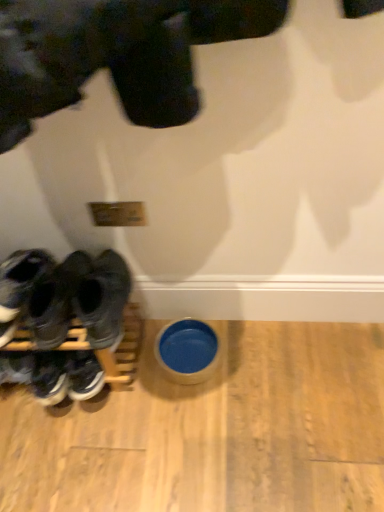
What do you see at coordinates (187, 351) in the screenshot? I see `blue ceramic bowl at lower center` at bounding box center [187, 351].

Locate an element on the screen. black rubber shoes at left, the 3th footwear viewed from the left is located at coordinates (103, 298).

In the image, is blue ceramic bowl at lower center on the left side or the right side of black leather sneakers at left, which is counted as the 1th footwear, starting from the left?

From the image, it's evident that blue ceramic bowl at lower center is to the right of black leather sneakers at left, which is counted as the 1th footwear, starting from the left.

Considering the sizes of blue ceramic bowl at lower center and black leather sneakers at left, which is the third footwear from right to left, in the image, is blue ceramic bowl at lower center taller or shorter than black leather sneakers at left, which is the third footwear from right to left,?

In the image, blue ceramic bowl at lower center appears to be shorter than black leather sneakers at left, which is the third footwear from right to left.

From the picture: Which object is more forward, blue ceramic bowl at lower center or black leather sneakers at left, which is the third footwear from right to left?

black leather sneakers at left, which is the third footwear from right to left, is more forward.

From the image's perspective, is black rubber shoes at left, the 3th footwear viewed from the left, above blue ceramic bowl at lower center?

Yes, from the image's perspective, black rubber shoes at left, the 3th footwear viewed from the left, is above blue ceramic bowl at lower center.

Considering the relative sizes of black rubber shoes at left, the 3th footwear viewed from the left, and blue ceramic bowl at lower center in the image provided, is black rubber shoes at left, the 3th footwear viewed from the left, taller than blue ceramic bowl at lower center?

Yes.

How different are the orientations of black rubber shoes at left, which is the 1th footwear in right-to-left order, and blue ceramic bowl at lower center in degrees?

6.23 degrees.

In the image, is black rubber shoes at left, the 3th footwear viewed from the left, positioned in front of or behind blue ceramic bowl at lower center?

Visually, black rubber shoes at left, the 3th footwear viewed from the left, is located in front of blue ceramic bowl at lower center.

Based on the photo, which is closer, (18, 289) or (51, 376)?

Point (18, 289) appears to be closer to the viewer than point (51, 376).

Considering the relative sizes of dark gray suede sneakers at left, the second footwear viewed from the right, and black leather sneakers at left, which is the third footwear from right to left, in the image provided, is dark gray suede sneakers at left, the second footwear viewed from the right, thinner than black leather sneakers at left, which is the third footwear from right to left,?

No, dark gray suede sneakers at left, the second footwear viewed from the right, is not thinner than black leather sneakers at left, which is the third footwear from right to left.

Is the depth of dark gray suede sneakers at left, the second footwear viewed from the right, greater than that of black leather sneakers at left, which is counted as the 1th footwear, starting from the left?

No, dark gray suede sneakers at left, the second footwear viewed from the right, is in front of black leather sneakers at left, which is counted as the 1th footwear, starting from the left.

Is blue ceramic bowl at lower center with dark gray suede sneakers at left, the second footwear viewed from the right?

blue ceramic bowl at lower center is not next to dark gray suede sneakers at left, the second footwear viewed from the right, and they're not touching.

Is blue ceramic bowl at lower center oriented away from dark gray suede sneakers at left, the second footwear viewed from the right?

blue ceramic bowl at lower center is not turned away from dark gray suede sneakers at left, the second footwear viewed from the right.

Between blue ceramic bowl at lower center and dark gray suede sneakers at left, the second footwear viewed from the right, which one appears on the right side from the viewer's perspective?

From the viewer's perspective, blue ceramic bowl at lower center appears more on the right side.

Based on the photo, how different are the orientations of dark gray suede sneakers at left, the second footwear viewed from the right, and black rubber shoes at left, which is the 1th footwear in right-to-left order, in degrees?

The angle between the facing direction of dark gray suede sneakers at left, the second footwear viewed from the right, and the facing direction of black rubber shoes at left, which is the 1th footwear in right-to-left order, is 4.07 degrees.

Is dark gray suede sneakers at left, the second footwear from the left, facing away from black rubber shoes at left, which is the 1th footwear in right-to-left order?

That's not correct — dark gray suede sneakers at left, the second footwear from the left, is not looking away from black rubber shoes at left, which is the 1th footwear in right-to-left order.

Looking at this image, which is behind, dark gray suede sneakers at left, the second footwear from the left, or black rubber shoes at left, the 3th footwear viewed from the left?

Positioned behind is dark gray suede sneakers at left, the second footwear from the left.

Considering the relative sizes of dark gray suede sneakers at left, the second footwear viewed from the right, and black rubber shoes at left, which is the 1th footwear in right-to-left order, in the image provided, is dark gray suede sneakers at left, the second footwear viewed from the right, smaller than black rubber shoes at left, which is the 1th footwear in right-to-left order,?

Yes.

Does black leather sneakers at left, which is the third footwear from right to left, have a larger size compared to blue ceramic bowl at lower center?

Yes.

Are black leather sneakers at left, which is the third footwear from right to left, and blue ceramic bowl at lower center located far from each other?

No, there isn't a large distance between black leather sneakers at left, which is the third footwear from right to left, and blue ceramic bowl at lower center.

From a real-world perspective, is black leather sneakers at left, which is counted as the 1th footwear, starting from the left, over blue ceramic bowl at lower center?

Yes, from a real-world perspective, black leather sneakers at left, which is counted as the 1th footwear, starting from the left, is above blue ceramic bowl at lower center.

Considering the relative positions of dark gray suede sneakers at left, the second footwear viewed from the right, and blue ceramic bowl at lower center in the image provided, is dark gray suede sneakers at left, the second footwear viewed from the right, to the right of blue ceramic bowl at lower center from the viewer's perspective?

No, dark gray suede sneakers at left, the second footwear viewed from the right, is not to the right of blue ceramic bowl at lower center.

Can you tell me how much dark gray suede sneakers at left, the second footwear from the left, and blue ceramic bowl at lower center differ in facing direction?

2.16 degrees.

Considering the relative positions of dark gray suede sneakers at left, the second footwear from the left, and blue ceramic bowl at lower center in the image provided, is dark gray suede sneakers at left, the second footwear from the left, behind blue ceramic bowl at lower center?

No, dark gray suede sneakers at left, the second footwear from the left, is closer to the camera.

Who is bigger, dark gray suede sneakers at left, the second footwear viewed from the right, or blue ceramic bowl at lower center?

dark gray suede sneakers at left, the second footwear viewed from the right.

From the image's perspective, starting from the blue ceramic bowl at lower center, which footwear is the 1st one above? Please provide its 2D coordinates.

[(61, 321)]

Where is `the 1st footwear to the left of the blue ceramic bowl at lower center, starting your count from the anchor`? The image size is (384, 512). the 1st footwear to the left of the blue ceramic bowl at lower center, starting your count from the anchor is located at coordinates (103, 298).

Based on their spatial positions, is dark gray suede sneakers at left, the second footwear viewed from the right, or black rubber shoes at left, the 3th footwear viewed from the left, closer to blue ceramic bowl at lower center?

black rubber shoes at left, the 3th footwear viewed from the left, lies closer to blue ceramic bowl at lower center than the other object.

Estimate the real-world distances between objects in this image. Which object is further from black rubber shoes at left, the 3th footwear viewed from the left, black leather sneakers at left, which is counted as the 1th footwear, starting from the left, or blue ceramic bowl at lower center?

blue ceramic bowl at lower center lies further to black rubber shoes at left, the 3th footwear viewed from the left, than the other object.

When comparing their distances from dark gray suede sneakers at left, the second footwear from the left, does blue ceramic bowl at lower center or black rubber shoes at left, which is the 1th footwear in right-to-left order, seem further?

blue ceramic bowl at lower center.

When comparing their distances from dark gray suede sneakers at left, the second footwear from the left, does black rubber shoes at left, which is the 1th footwear in right-to-left order, or blue ceramic bowl at lower center seem further?

blue ceramic bowl at lower center.

Based on their spatial positions, is blue ceramic bowl at lower center or black leather sneakers at left, which is counted as the 1th footwear, starting from the left, further from black rubber shoes at left, the 3th footwear viewed from the left?

blue ceramic bowl at lower center is further to black rubber shoes at left, the 3th footwear viewed from the left.

When comparing their distances from black leather sneakers at left, which is counted as the 1th footwear, starting from the left, does dark gray suede sneakers at left, the second footwear from the left, or black rubber shoes at left, the 3th footwear viewed from the left, seem closer?

dark gray suede sneakers at left, the second footwear from the left, lies closer to black leather sneakers at left, which is counted as the 1th footwear, starting from the left, than the other object.

Considering their positions, is blue ceramic bowl at lower center positioned further to black rubber shoes at left, which is the 1th footwear in right-to-left order, than dark gray suede sneakers at left, the second footwear from the left?

blue ceramic bowl at lower center.

When comparing their distances from dark gray suede sneakers at left, the second footwear from the left, does black leather sneakers at left, which is counted as the 1th footwear, starting from the left, or black rubber shoes at left, the 3th footwear viewed from the left, seem further?

Among the two, black rubber shoes at left, the 3th footwear viewed from the left, is located further to dark gray suede sneakers at left, the second footwear from the left.

Identify the location of footwear located between dark gray suede sneakers at left, the second footwear from the left, and blue ceramic bowl at lower center in the left-right direction. (103, 298).

The image size is (384, 512). I want to click on footwear located between black leather sneakers at left, which is counted as the 1th footwear, starting from the left, and black rubber shoes at left, which is the 1th footwear in right-to-left order, in the left-right direction, so click(35, 297).